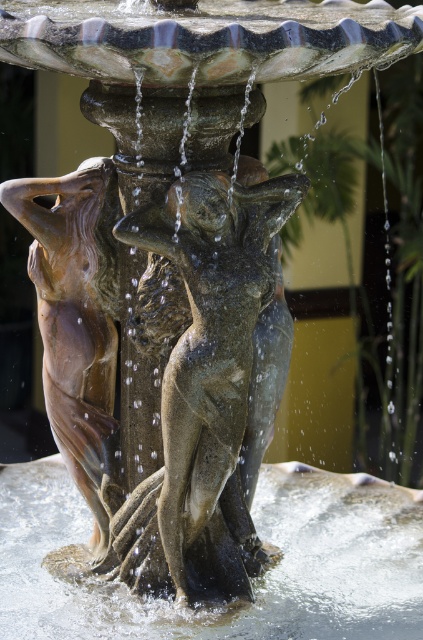
You are a photographer standing in front of the fountain. You want to capture a photo where the bronze statue at center is in focus while the clear water at base center is blurred. Is this possible with your current camera settings?

Yes, since the bronze statue at center is closer to the viewer than the clear water at base center, adjusting the camera focus to the bronze statue will blur the background, which includes the clear water at base center.

You are designing a pathway around the fountain and need to know the relative sizes of the bronze statue at center and the clear water at base center. Which one is wider?

The bronze statue at center has a lesser width compared to clear water at base center, so the clear water at base center is wider.